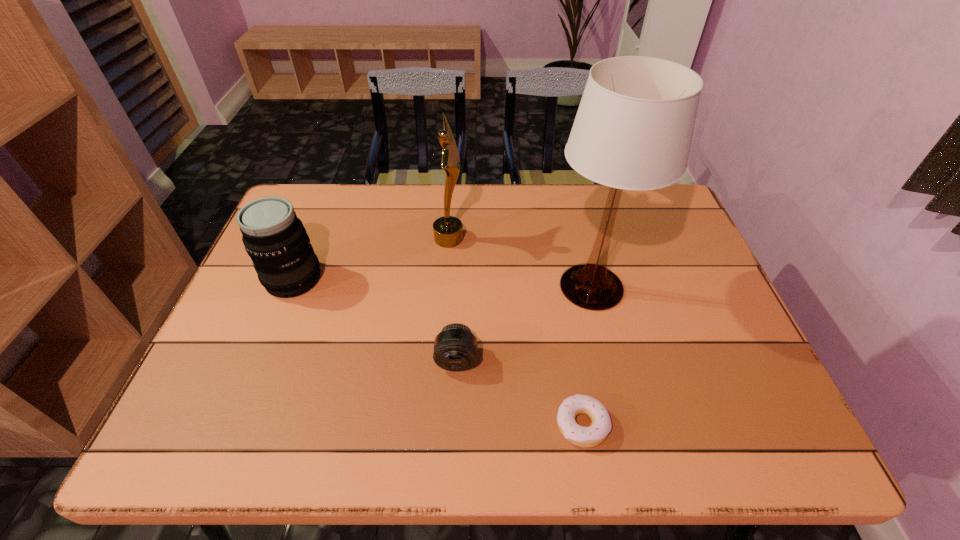
What are the coordinates of `vacant space that's between the farthest object and the left telephoto lens` in the screenshot? It's located at (372, 259).

The height and width of the screenshot is (540, 960). In order to click on vacant region between the doughnut and the tallest object in this screenshot , I will do `click(587, 356)`.

Image resolution: width=960 pixels, height=540 pixels. Identify the location of unoccupied area between the award and the doughnut. (516, 331).

Identify which object is the closest to the second tallest object. Please provide its 2D coordinates. Your answer should be formatted as a tuple, i.e. [(x, y)], where the tuple contains the x and y coordinates of a point satisfying the conditions above.

[(633, 130)]

Identify which object is the third nearest to the leftmost object. Please provide its 2D coordinates. Your answer should be formatted as a tuple, i.e. [(x, y)], where the tuple contains the x and y coordinates of a point satisfying the conditions above.

[(633, 130)]

Image resolution: width=960 pixels, height=540 pixels. I want to click on vacant space that satisfies the following two spatial constraints: 1. on the front-facing side of the award; 2. on the right side of the doughnut, so click(435, 424).

Locate an element on the screen. free space that satisfies the following two spatial constraints: 1. on the front-facing side of the nearest object; 2. on the left side of the farthest object is located at coordinates (435, 424).